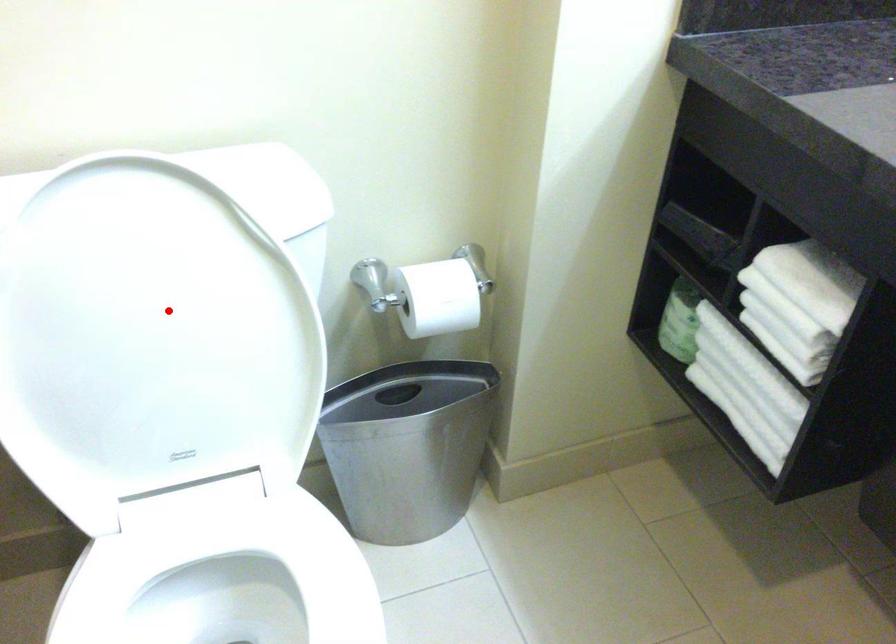
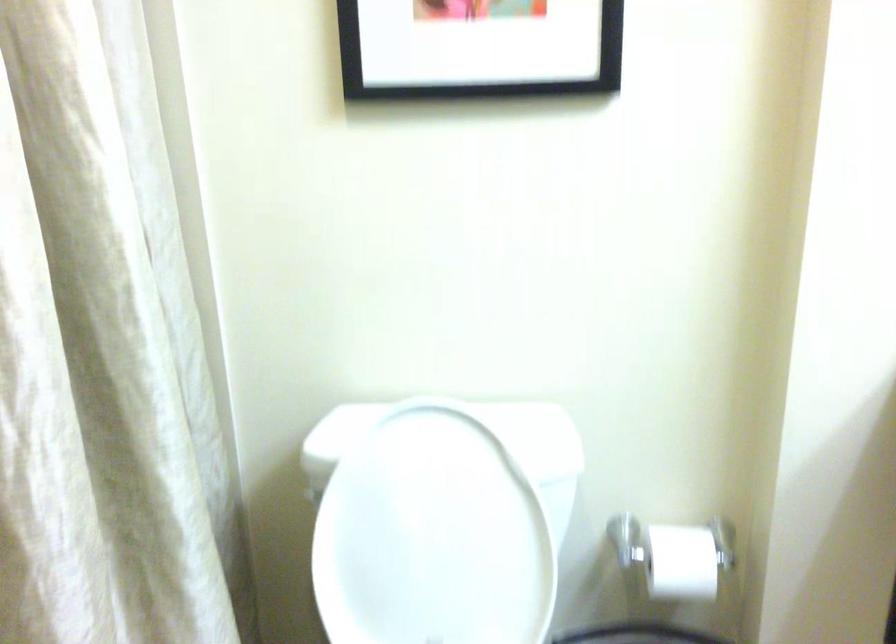
Question: A red point is marked in image1. In image2, is the corresponding 3D point closer to the camera or farther? Reply with the corresponding letter.

Choices:
 (A) The corresponding 3D point is closer.
 (B) The corresponding 3D point is farther.

Answer: (B)